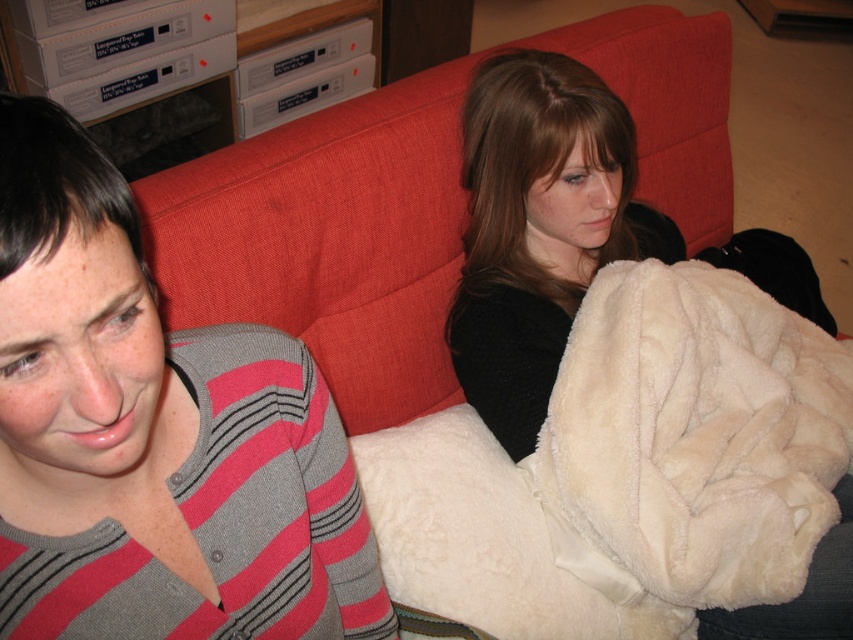
Which is below, gray striped sweater at left or white fluffy blanket at center?

gray striped sweater at left is lower down.

Consider the image. Measure the distance between gray striped sweater at left and white fluffy blanket at center.

gray striped sweater at left and white fluffy blanket at center are 68.78 centimeters apart.

Find the location of a particular element. Image resolution: width=853 pixels, height=640 pixels. gray striped sweater at left is located at coordinates (154, 435).

The height and width of the screenshot is (640, 853). What are the coordinates of `gray striped sweater at left` in the screenshot? It's located at (154, 435).